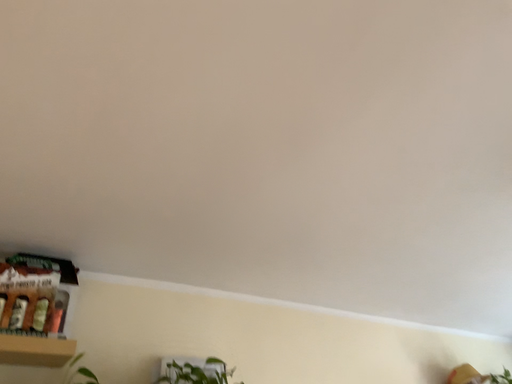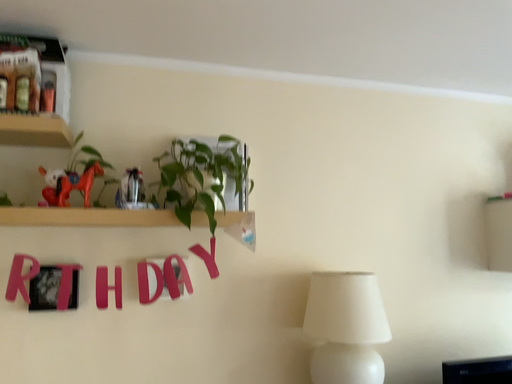
Question: Which way did the camera rotate in the video?

Choices:
 (A) rotated right
 (B) rotated left

Answer: (B)